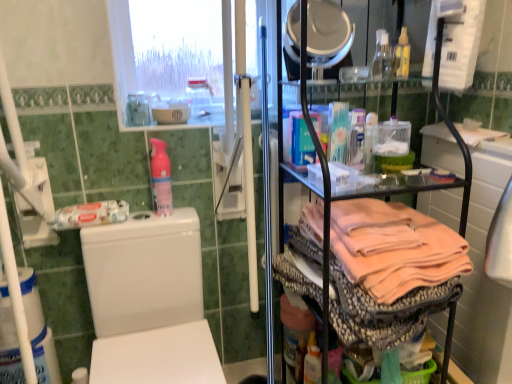
Question: In terms of size, does white glossy mirror at upper center appear bigger or smaller than white mesh screen at upper center?

Choices:
 (A) big
 (B) small

Answer: (B)

Question: From the image's perspective, is white glossy mirror at upper center positioned above or below white mesh screen at upper center?

Choices:
 (A) above
 (B) below

Answer: (B)

Question: Which of these objects is positioned farthest from the transparent plastic spray bottle at upper center, the 3th bottle viewed from the left?

Choices:
 (A) white mesh screen at upper center
 (B) transparent glass bottle at upper center, which is the 1th bottle in left-to-right order
 (C) white glossy toilet at left
 (D) yellow translucent spray bottle at upper right, acting as the first bottle starting from the right
 (E) white glossy bowl at upper center

Answer: (D)

Question: Considering the real-world distances, which object is farthest from the white glossy mirror at upper center?

Choices:
 (A) pink plastic spray bottle at upper center, which is the second bottle from left to right
 (B) transparent plastic spray bottle at upper center, the third bottle in the right-to-left sequence
 (C) yellow translucent spray bottle at upper right, acting as the first bottle starting from the right
 (D) white mesh screen at upper center
 (E) transparent glass bottle at upper right, which appears as the fourth bottle when viewed from the left

Answer: (A)